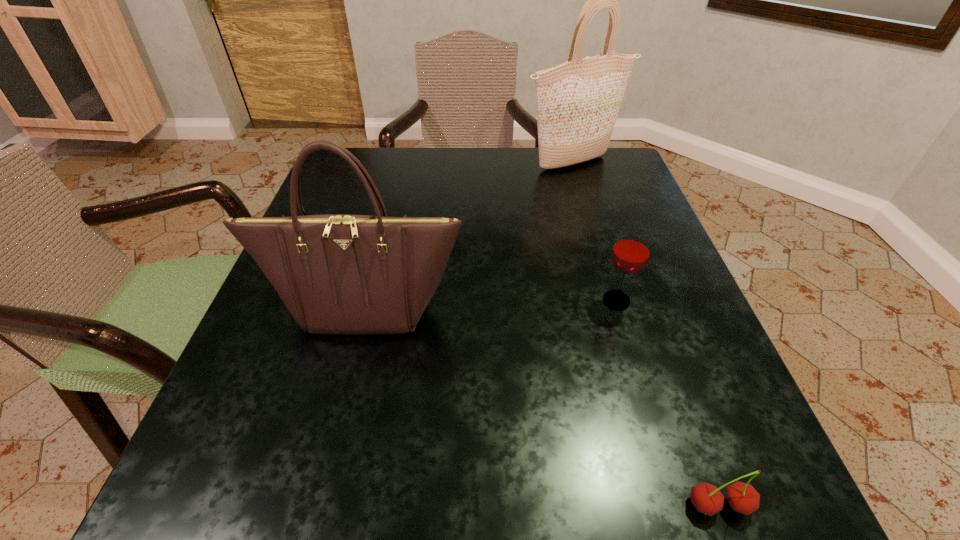
This screenshot has height=540, width=960. I want to click on object positioned at the far edge, so click(x=578, y=101).

Find the location of a particular element. This screenshot has width=960, height=540. object located in the near edge section of the desktop is located at coordinates (742, 497).

What are the coordinates of `object present at the left edge` in the screenshot? It's located at (341, 274).

Where is `shopping bag situated at the right edge`? Image resolution: width=960 pixels, height=540 pixels. shopping bag situated at the right edge is located at coordinates pyautogui.click(x=578, y=101).

Where is `glass that is at the right edge`? glass that is at the right edge is located at coordinates (631, 251).

This screenshot has width=960, height=540. Identify the location of cherry that is at the right edge. (742, 497).

Locate an element on the screen. object that is at the far right corner is located at coordinates (578, 101).

I want to click on object that is at the near right corner, so click(742, 497).

You are a GUI agent. You are given a task and a screenshot of the screen. Output one action in this format:
    pyautogui.click(x=<x>, y=<y>)
    Task: Click on the free space at the far edge
    This screenshot has height=540, width=960.
    Given the screenshot: What is the action you would take?
    pyautogui.click(x=477, y=157)

At what (x,y) coordinates should I click in order to perform the action: click on vacant space at the near edge. Please return your answer as a coordinate pair (x, y). Looking at the image, I should click on (418, 465).